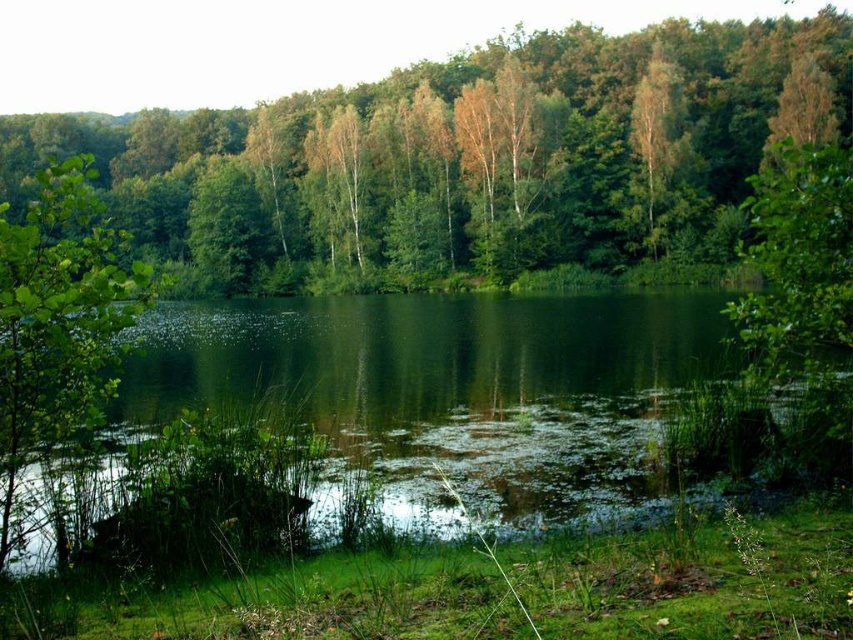
Can you confirm if green leafy tree at center is taller than green liquid at center?

Correct, green leafy tree at center is much taller as green liquid at center.

Which is more to the right, green leafy tree at center or green liquid at center?

green liquid at center is more to the right.

Identify the location of green leafy tree at center. The height and width of the screenshot is (640, 853). (463, 160).

This screenshot has width=853, height=640. In order to click on green leafy tree at center in this screenshot , I will do `click(463, 160)`.

Between green liquid at center and green leafy tree at left, which one has less height?

green liquid at center is shorter.

Between point (619, 296) and point (59, 333), which one is positioned behind?

The point (619, 296) is behind.

This screenshot has height=640, width=853. Find the location of `green liquid at center`. green liquid at center is located at coordinates (445, 396).

Does green leafy tree at center appear under green leafy tree at left?

Incorrect, green leafy tree at center is not positioned below green leafy tree at left.

Measure the distance between green leafy tree at center and camera.

green leafy tree at center is 28.74 feet from camera.

This screenshot has width=853, height=640. What are the coordinates of `green leafy tree at center` in the screenshot? It's located at tap(463, 160).